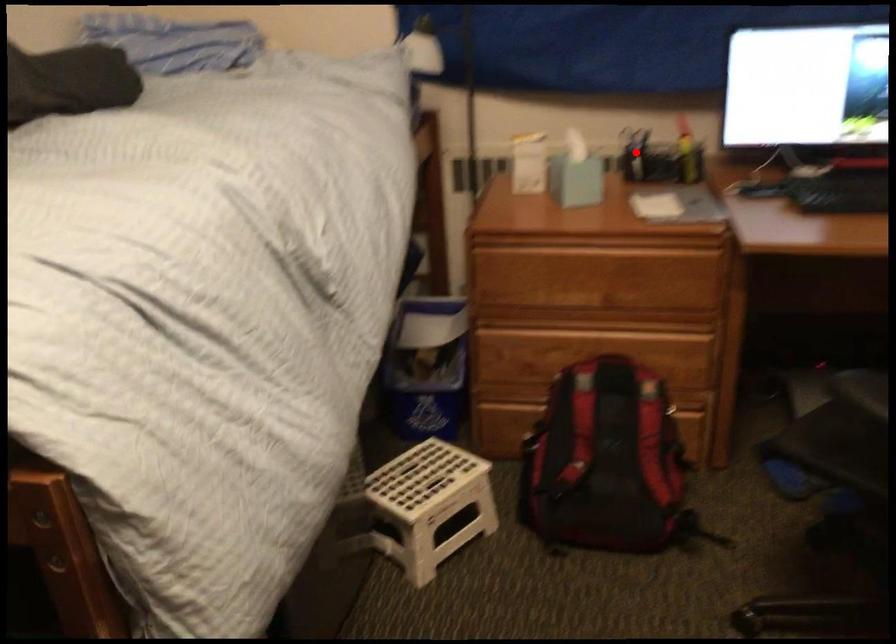
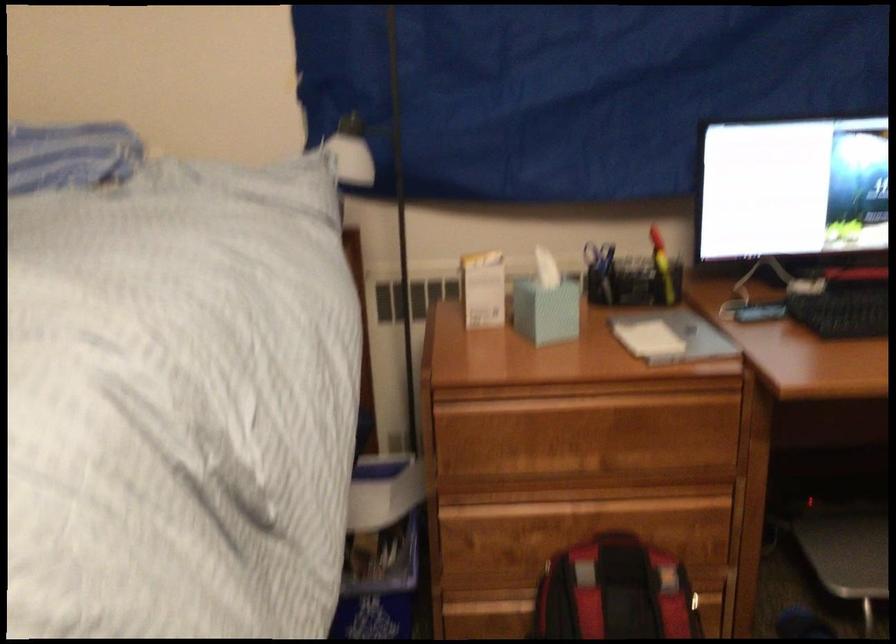
Question: I am providing you with two images of the same scene from different viewpoints. A red point is shown in image1. For the corresponding object point in image2, is it positioned nearer or farther from the camera?

Choices:
 (A) Nearer
 (B) Farther

Answer: (A)